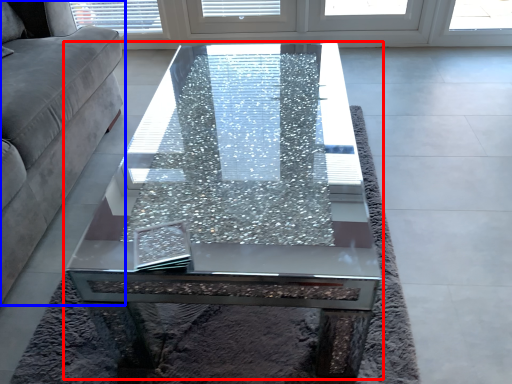
Question: Among these objects, which one is nearest to the camera, coffee table (highlighted by a red box) or studio couch (highlighted by a blue box)?

Choices:
 (A) coffee table
 (B) studio couch

Answer: (B)